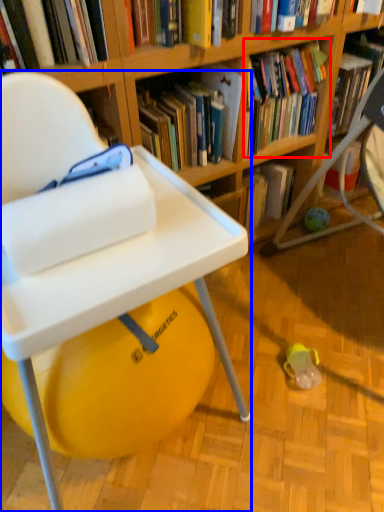
Question: Which object appears farthest to the camera in this image, book (highlighted by a red box) or chair (highlighted by a blue box)?

Choices:
 (A) book
 (B) chair

Answer: (A)